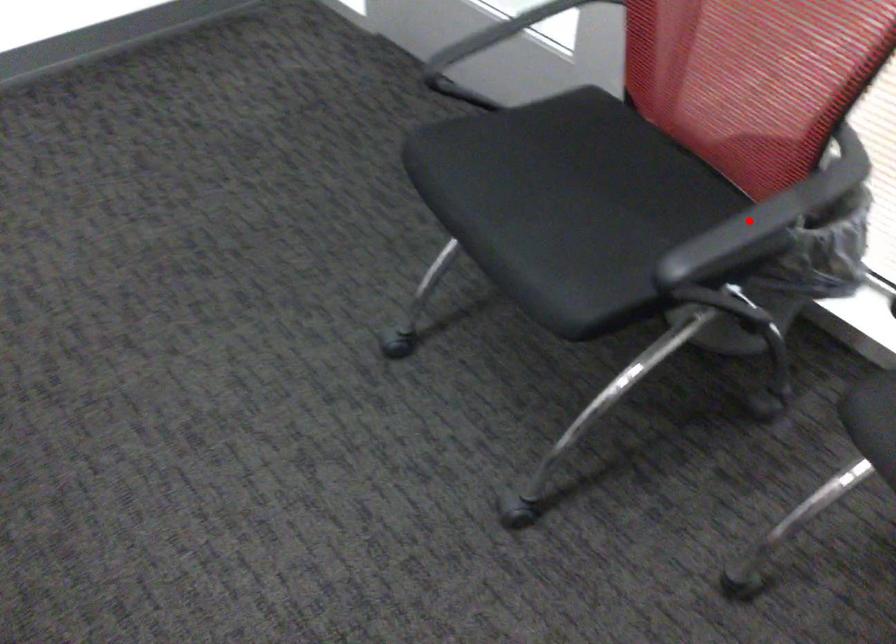
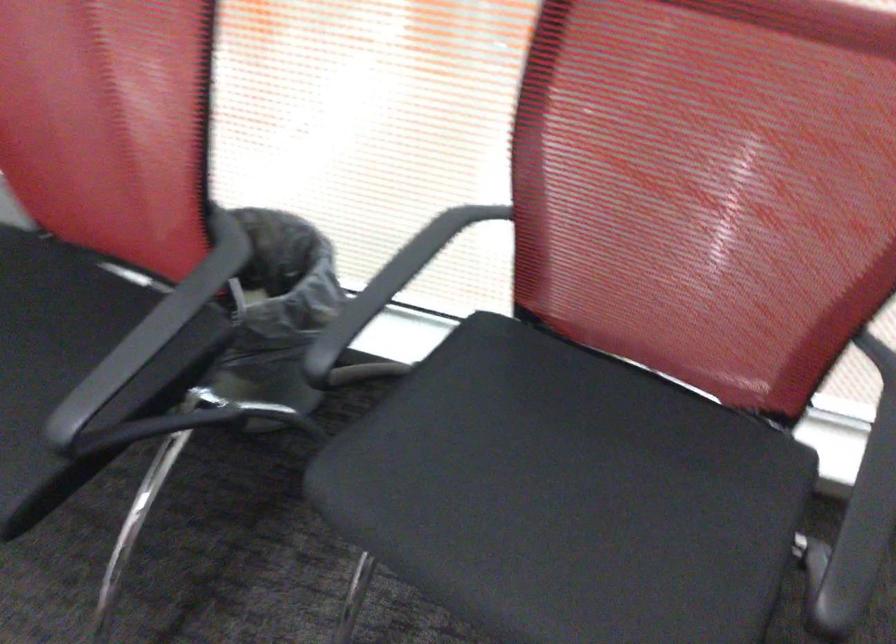
Question: I am providing you with two images of the same scene from different viewpoints. Given a red point in image1, look at the same physical point in image2. Is it:

Choices:
 (A) Closer to the viewpoint
 (B) Farther from the viewpoint

Answer: (A)